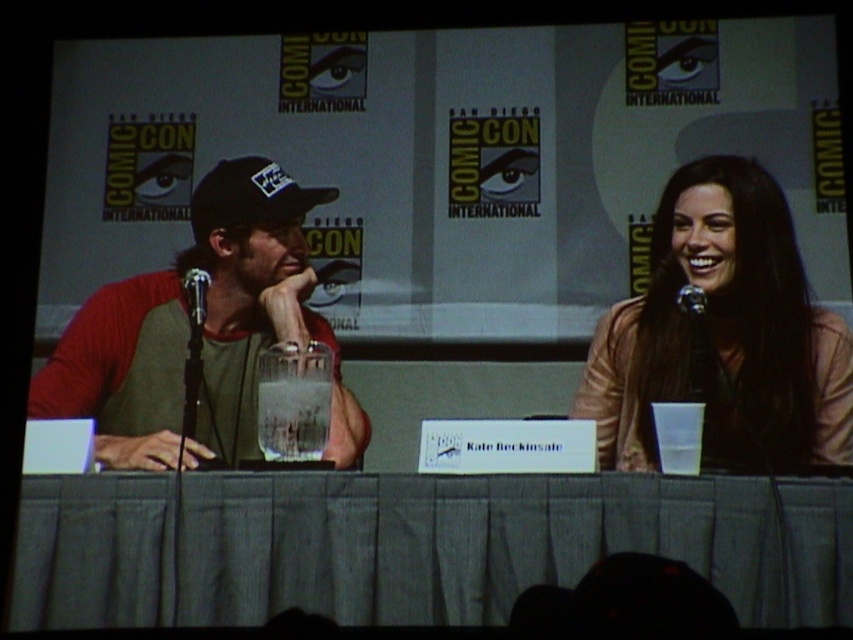
Which of these two, matte green t-shirt at left or metallic silver microphone at center, stands taller?

matte green t-shirt at left

Is matte green t-shirt at left below metallic silver microphone at center?

Correct, matte green t-shirt at left is located below metallic silver microphone at center.

Does point (230, 397) come closer to viewer compared to point (202, 301)?

Yes, point (230, 397) is closer to viewer.

Locate an element on the screen. The image size is (853, 640). matte green t-shirt at left is located at coordinates (200, 332).

Image resolution: width=853 pixels, height=640 pixels. What do you see at coordinates (497, 541) in the screenshot?
I see `gray fabric table at center` at bounding box center [497, 541].

Can you confirm if gray fabric table at center is taller than black matte baseball cap at left?

Yes, gray fabric table at center is taller than black matte baseball cap at left.

The image size is (853, 640). What are the coordinates of `gray fabric table at center` in the screenshot? It's located at (497, 541).

Does gray fabric table at center have a larger size compared to matte pink sweater at right?

No.

Who is positioned more to the left, gray fabric table at center or matte pink sweater at right?

gray fabric table at center is more to the left.

Where is `gray fabric table at center`? gray fabric table at center is located at coordinates (497, 541).

Identify the location of gray fabric table at center. Image resolution: width=853 pixels, height=640 pixels. click(x=497, y=541).